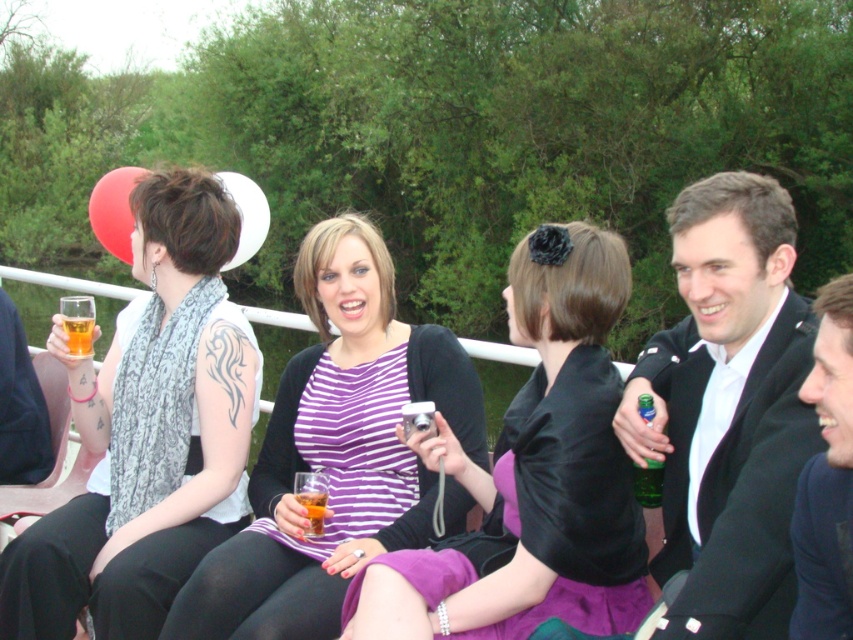
Between point (833, 504) and point (320, 529), which one is positioned behind?

The point (320, 529) is behind.

Does navy blue suit at right have a greater height compared to translucent glass beverage at center?

Yes, navy blue suit at right is taller than translucent glass beverage at center.

This screenshot has width=853, height=640. What do you see at coordinates (827, 477) in the screenshot? I see `navy blue suit at right` at bounding box center [827, 477].

What are the coordinates of `navy blue suit at right` in the screenshot? It's located at (827, 477).

This screenshot has width=853, height=640. I want to click on purple striped shirt at center, so (334, 451).

Between purple striped shirt at center and translucent glass at upper left, which one appears on the right side from the viewer's perspective?

purple striped shirt at center

Is point (421, 540) farther from viewer compared to point (65, 332)?

No.

Locate an element on the screen. The image size is (853, 640). purple striped shirt at center is located at coordinates (334, 451).

Can you confirm if black satin suit at right is positioned above translucent glass at upper left?

Incorrect, black satin suit at right is not positioned above translucent glass at upper left.

Who is shorter, black satin suit at right or translucent glass at upper left?

With less height is translucent glass at upper left.

Is point (715, 572) in front of point (86, 340)?

Yes, it is in front of point (86, 340).

You are a GUI agent. You are given a task and a screenshot of the screen. Output one action in this format:
    pyautogui.click(x=<x>, y=<y>)
    Task: Click on the black satin suit at right
    This screenshot has height=640, width=853.
    Given the screenshot: What is the action you would take?
    pyautogui.click(x=726, y=412)